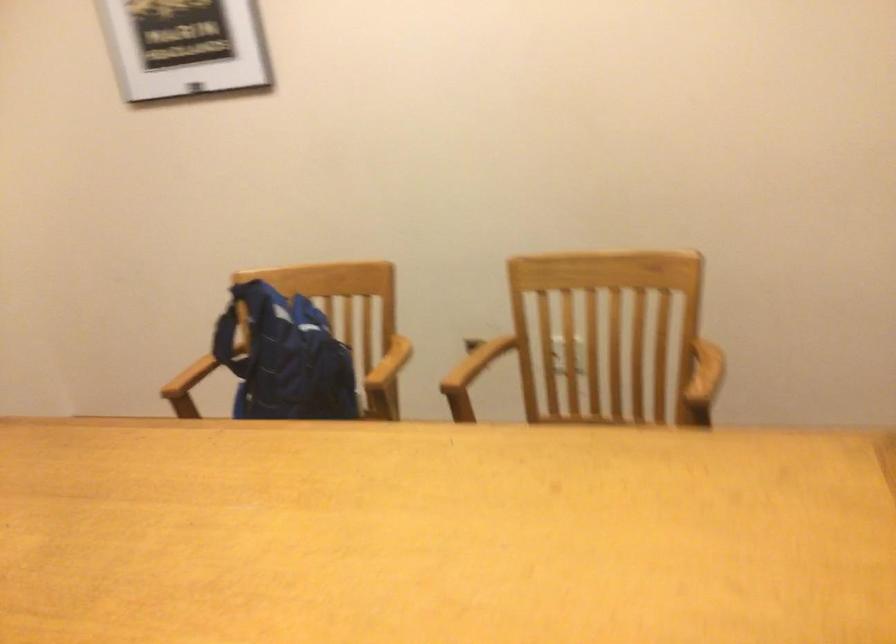
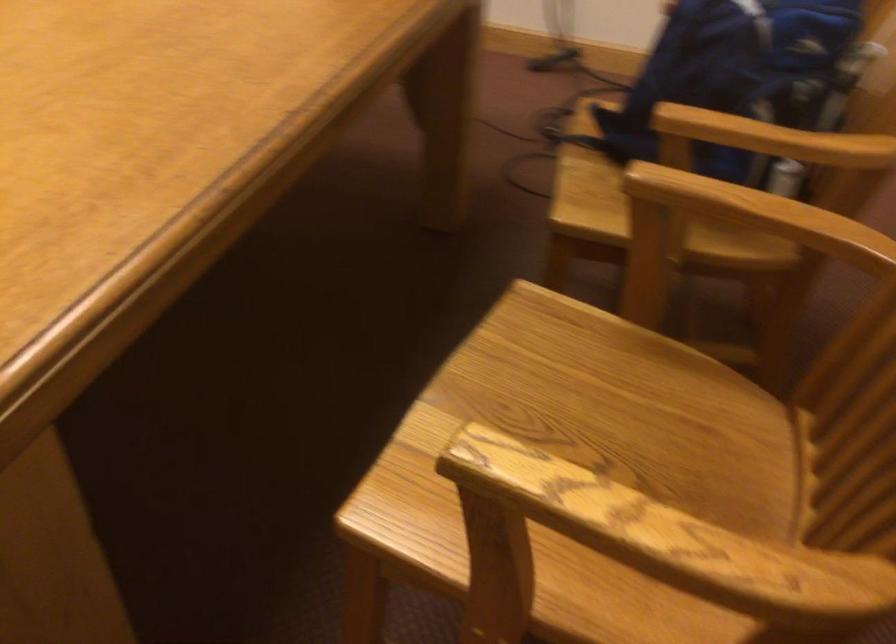
The point at (328, 357) is marked in the first image. Where is the corresponding point in the second image?

(736, 73)